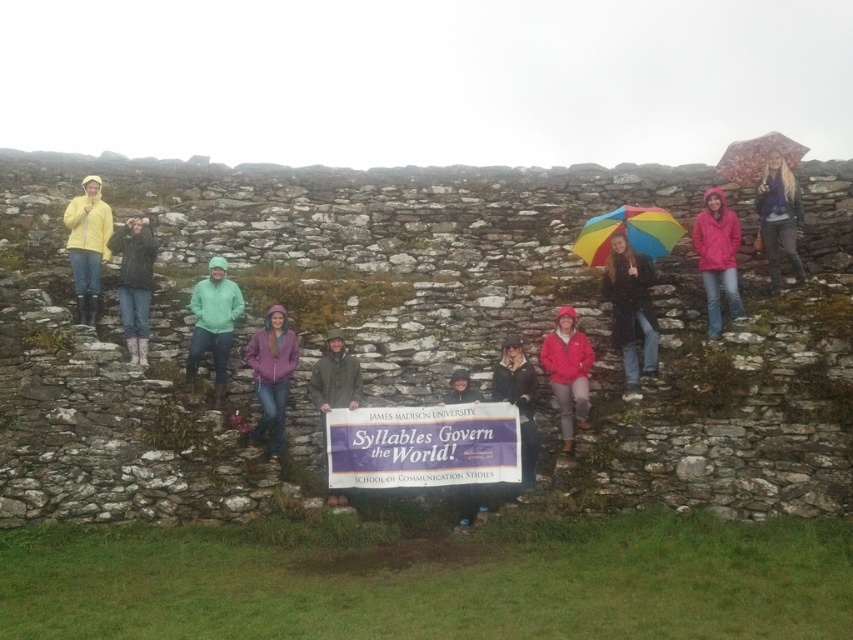
You are a photographer trying to adjust the composition of the group photo. You notice two jackets labeled as pink matte jacket at center and matte pink jacket at center. Which jacket should you move to ensure both are visible in the frame?

The pink matte jacket at center is much taller than the matte pink jacket at center. To ensure both are visible, move the shorter matte pink jacket at center slightly forward or adjust its position so it isn

Consider the image. You are a photographer standing at the camera position. You want to capture a closeup shot of the rainbow fabric umbrella at upper center. Given that the umbrella is 66.87 meters away, is it possible to take a clear photo without moving closer?

The rainbow fabric umbrella at upper center is 66.87 meters away from the camera. At this distance, capturing a clear closeup shot without moving closer would be challenging due to the umbrella being too far away.